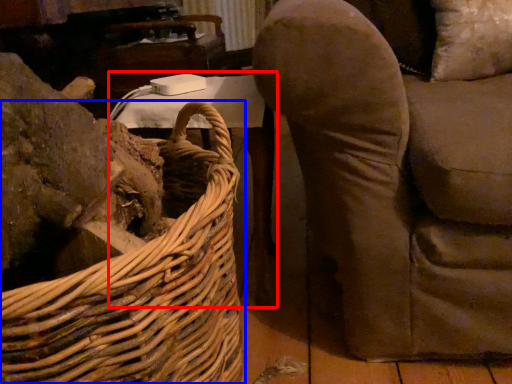
Question: Which point is further to the camera, table (highlighted by a red box) or picnic basket (highlighted by a blue box)?

Choices:
 (A) table
 (B) picnic basket

Answer: (A)